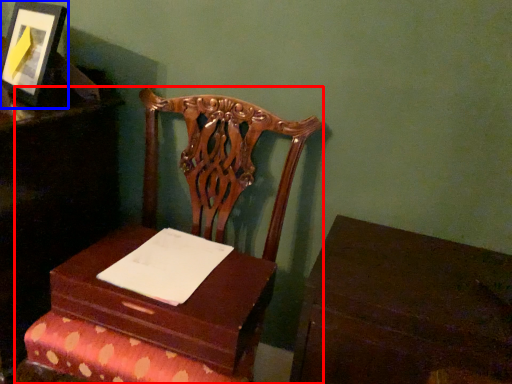
Question: Among these objects, which one is nearest to the camera, furniture (highlighted by a red box) or picture frame (highlighted by a blue box)?

Choices:
 (A) furniture
 (B) picture frame

Answer: (A)